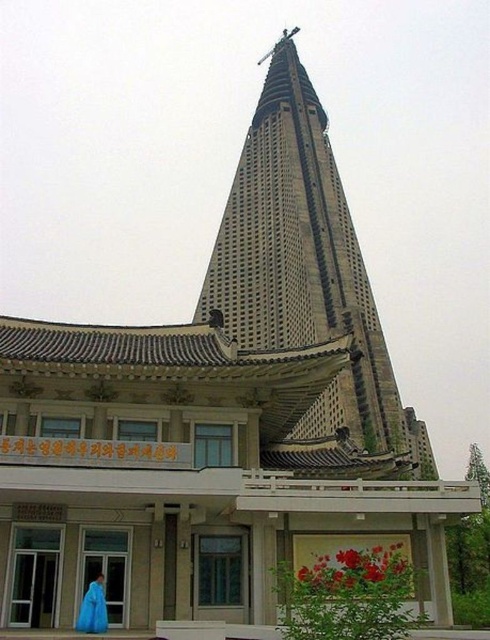
Can you confirm if gray concrete tower at center is positioned to the left of blue fabric at lower left?

Incorrect, gray concrete tower at center is not on the left side of blue fabric at lower left.

Is point (302, 104) positioned before point (87, 608)?

No, it is not.

Is point (277, 108) closer to viewer compared to point (90, 582)?

No, (277, 108) is further to viewer.

You are a GUI agent. You are given a task and a screenshot of the screen. Output one action in this format:
    pyautogui.click(x=<x>, y=<y>)
    Task: Click on the gray concrete tower at center
    
    Given the screenshot: What is the action you would take?
    pyautogui.click(x=305, y=266)